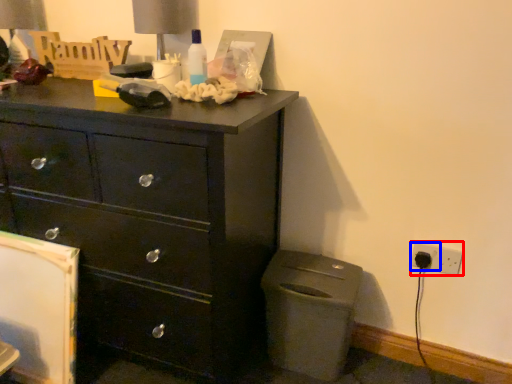
Question: Which point is further to the camera, electric outlet (highlighted by a red box) or electric outlet (highlighted by a blue box)?

Choices:
 (A) electric outlet
 (B) electric outlet

Answer: (B)